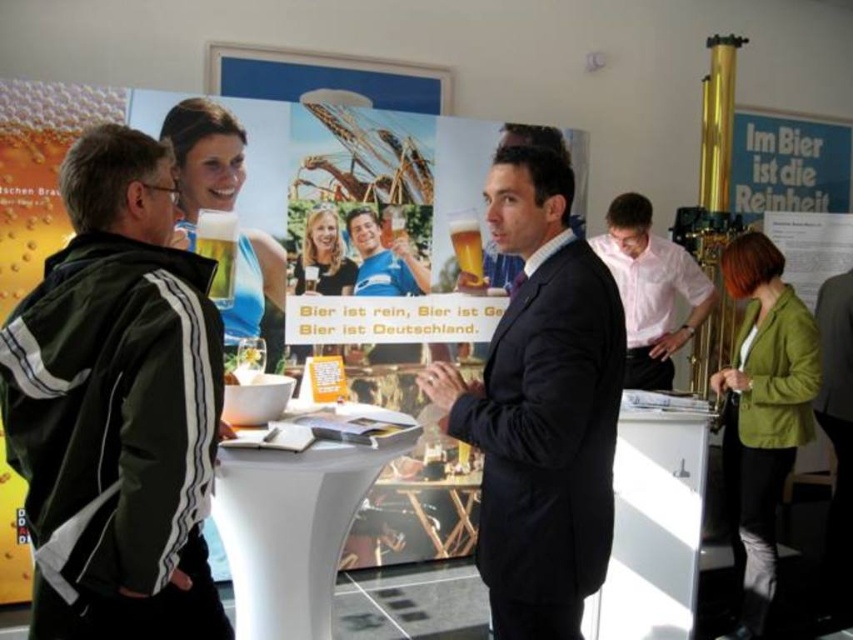
You are a photographer at the event and want to capture both the dark suit at center and the green cotton jacket at lower right in a single shot. Since you can only focus on one subject clearly, which one should you choose to ensure it appears sharp in the photo?

The dark suit at center is closer to the viewer than the green cotton jacket at lower right, so focusing on the dark suit at center will ensure it appears sharp while the green cotton jacket at lower right may be slightly blurred.

You are standing at the origin point of the coordinate system in the image. Where is the dark gray suit at center located in terms of coordinates?

The dark gray suit at center is located at coordinates point [836,442].